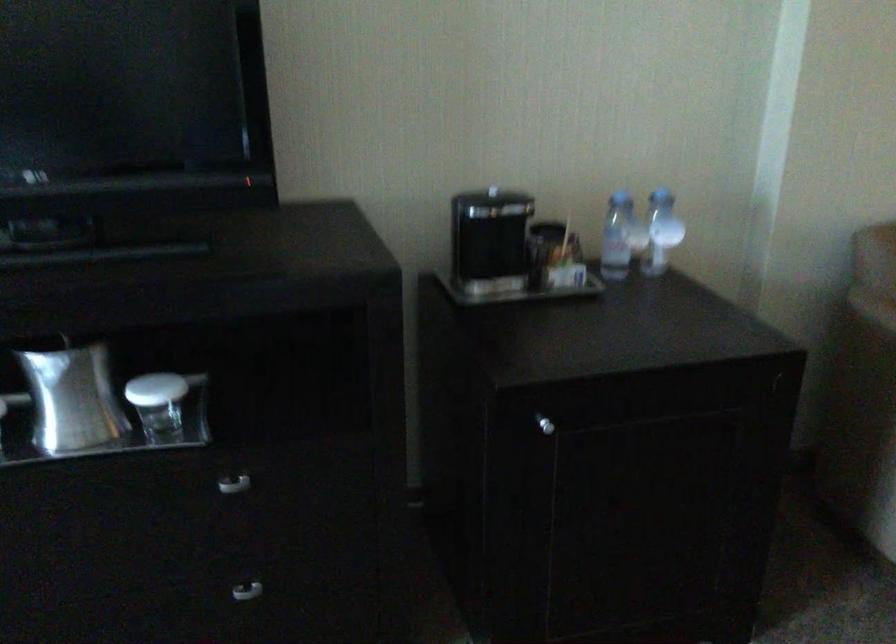
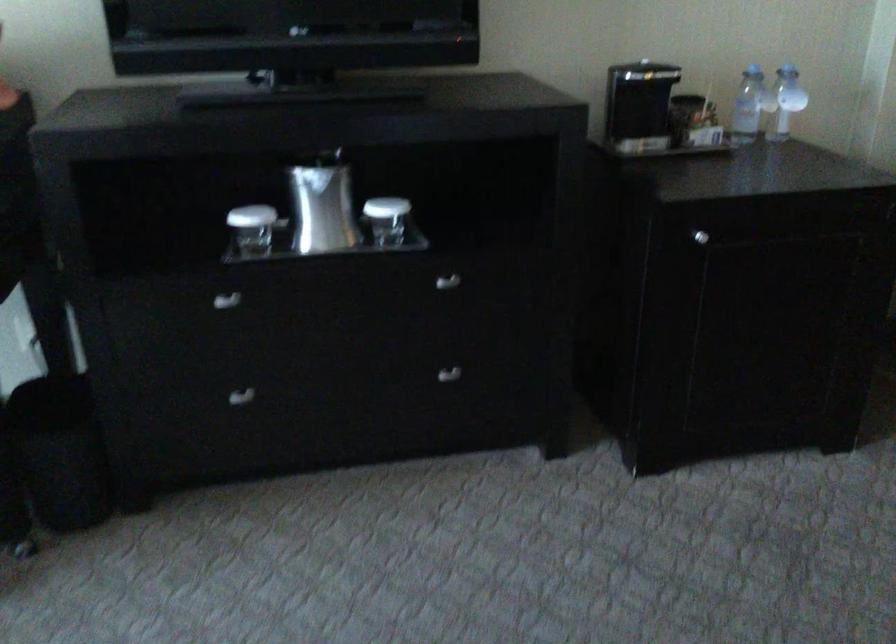
Question: How did the camera likely rotate?

Choices:
 (A) Left
 (B) Right
 (C) Up
 (D) Down

Answer: (A)